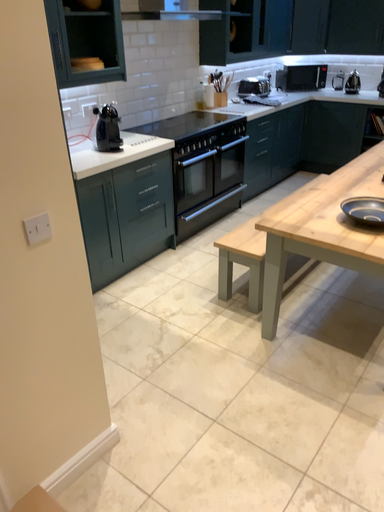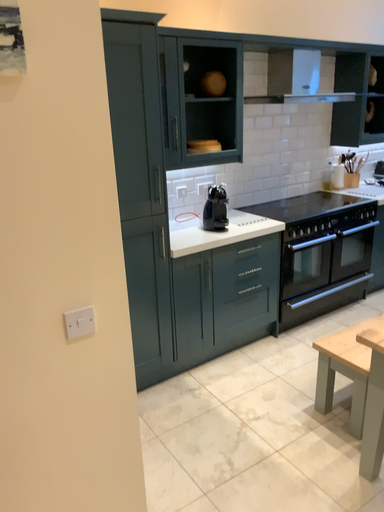
Question: How did the camera likely rotate when shooting the video?

Choices:
 (A) rotated upward
 (B) rotated downward

Answer: (A)